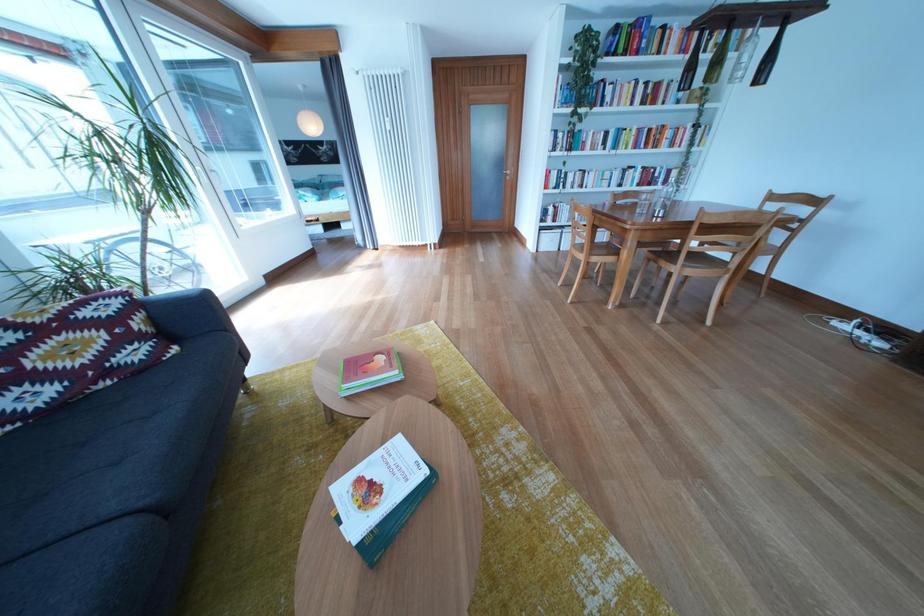
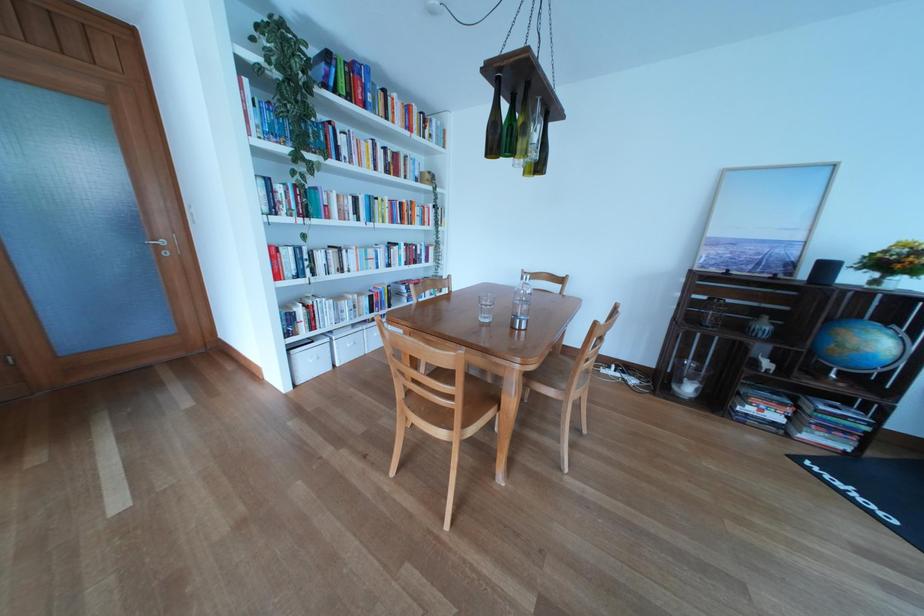
Locate, in the second image, the point that corresponds to pixel 573 237 in the first image.

(341, 345)